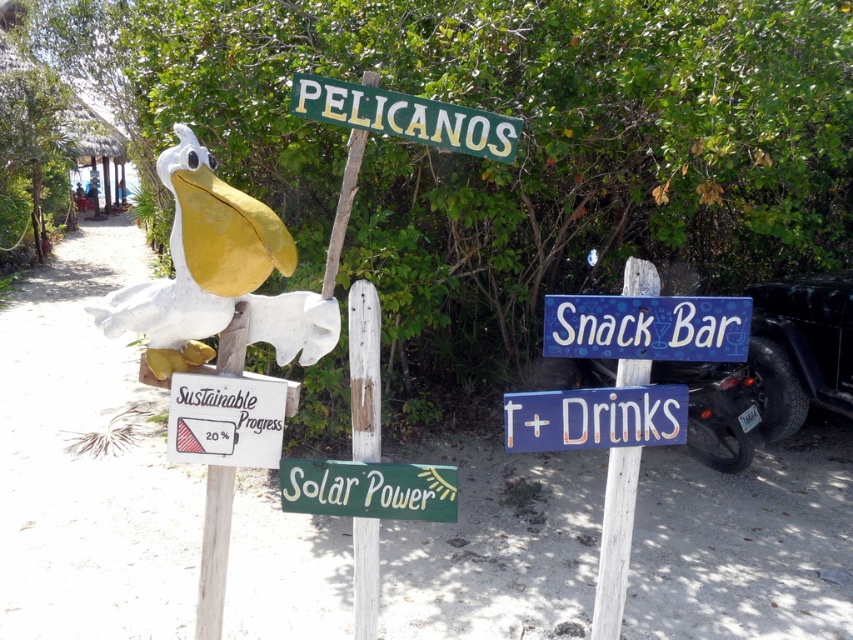
Consider the image. Who is higher up, wooden signboard at center or green painted wood sign at upper center?

green painted wood sign at upper center is higher up.

Between wooden signboard at center and green painted wood sign at upper center, which one appears on the right side from the viewer's perspective?

From the viewer's perspective, wooden signboard at center appears more on the right side.

In order to click on wooden signboard at center in this screenshot , I will do `click(595, 417)`.

At what (x,y) coordinates should I click in order to perform the action: click on wooden signboard at center. Please return your answer as a coordinate pair (x, y). The width and height of the screenshot is (853, 640). Looking at the image, I should click on (595, 417).

Between green painted wood sign at upper center and white wood pole at center, which one appears on the left side from the viewer's perspective?

Positioned to the left is white wood pole at center.

This screenshot has height=640, width=853. In order to click on green painted wood sign at upper center in this screenshot , I will do `click(405, 116)`.

Between white wooden signpost at center and white wood sign at lower left, which one appears on the right side from the viewer's perspective?

white wood sign at lower left

Can you confirm if white wooden signpost at center is positioned above white wood sign at lower left?

No, white wooden signpost at center is not above white wood sign at lower left.

Does point (38, 392) come in front of point (265, 458)?

No, (38, 392) is further to viewer.

This screenshot has height=640, width=853. I want to click on white wooden signpost at center, so click(86, 465).